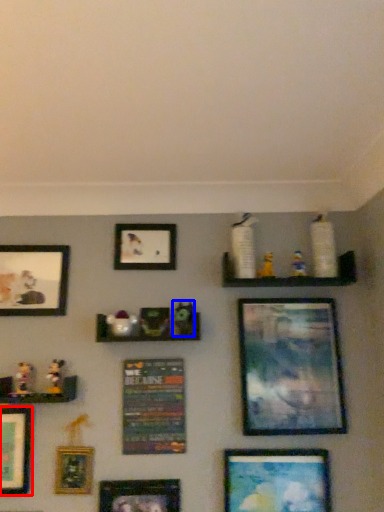
Question: Which point is further to the camera, picture frame (highlighted by a red box) or toy (highlighted by a blue box)?

Choices:
 (A) picture frame
 (B) toy

Answer: (B)